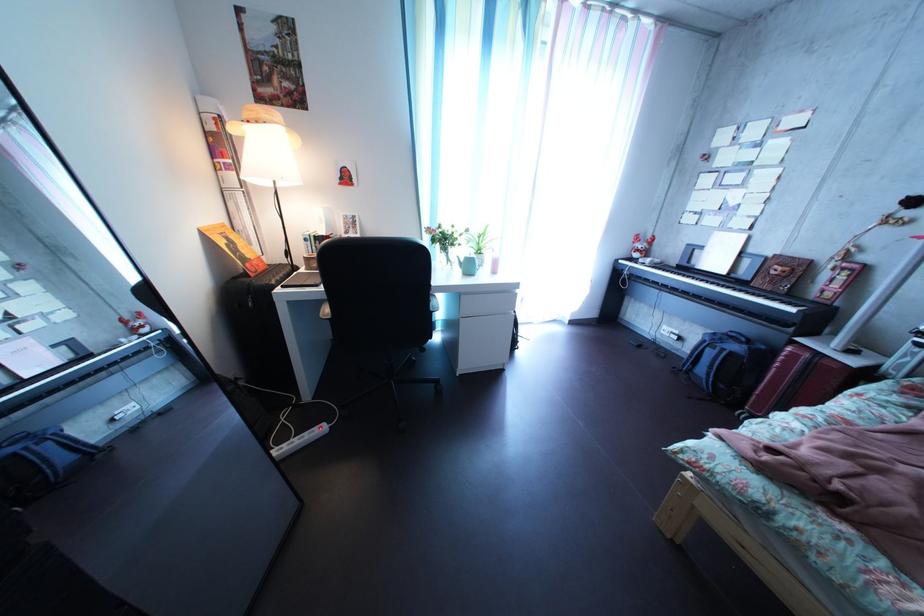
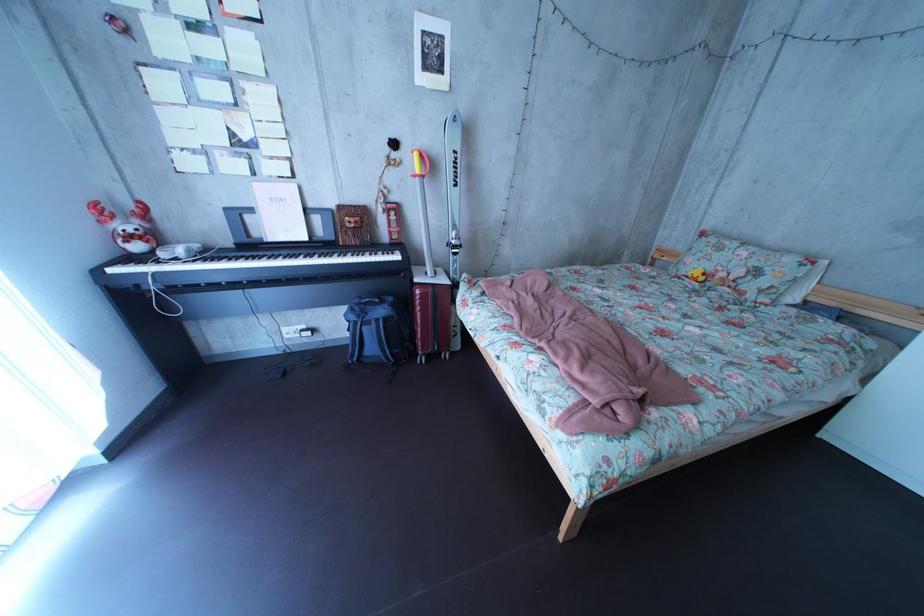
Find the pixel in the second image that matches (x=749, y=355) in the first image.

(395, 320)